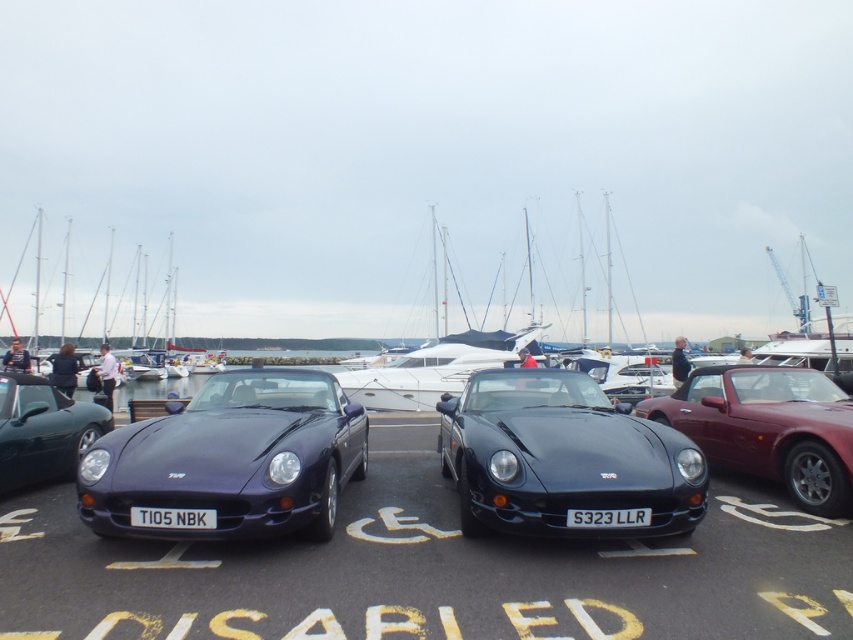
Between matte black car at center and white glossy sailboat at left, which one is positioned lower?

matte black car at center is lower down.

Between point (668, 515) and point (9, 289), which one is positioned behind?

Positioned behind is point (9, 289).

This screenshot has width=853, height=640. I want to click on matte black car at center, so pos(572,445).

Does white glossy boat at center lie behind white plastic license plate at center?

Yes, white glossy boat at center is behind white plastic license plate at center.

In the scene shown: Which is more to the left, white glossy boat at center or white plastic license plate at center?

From the viewer's perspective, white plastic license plate at center appears more on the left side.

Is point (404, 365) farther from viewer compared to point (189, 525)?

Yes, it is.

At what (x,y) coordinates should I click in order to perform the action: click on white glossy boat at center. Please return your answer as a coordinate pair (x, y). The height and width of the screenshot is (640, 853). Looking at the image, I should click on (434, 369).

Is glossy black car at center below shiny dark green convertible at left?

Indeed, glossy black car at center is positioned under shiny dark green convertible at left.

Between glossy black car at center and shiny dark green convertible at left, which one has less height?

glossy black car at center

What do you see at coordinates (430, 572) in the screenshot? Image resolution: width=853 pixels, height=640 pixels. I see `glossy black car at center` at bounding box center [430, 572].

I want to click on glossy black car at center, so click(x=430, y=572).